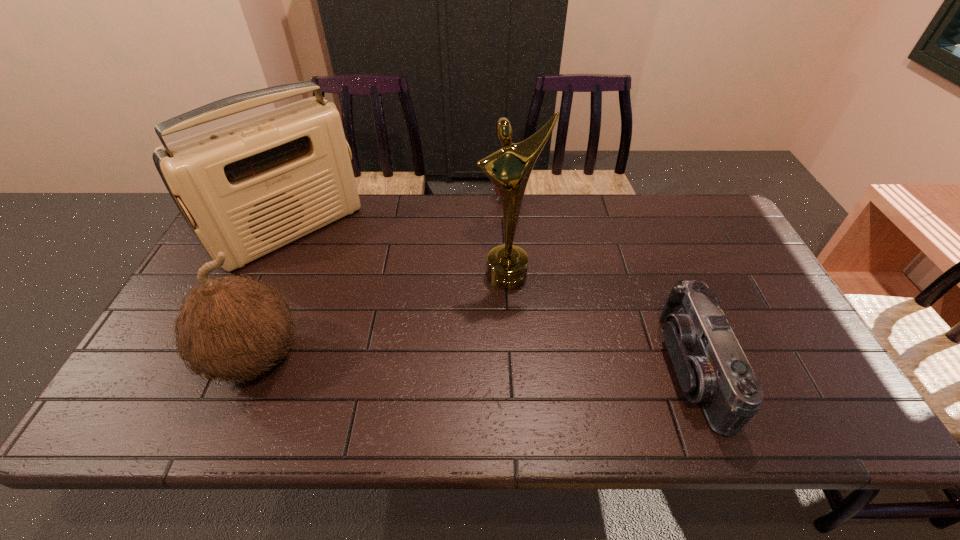
This screenshot has height=540, width=960. In order to click on camcorder that is at the near edge in this screenshot , I will do `click(712, 369)`.

Find the location of a particular element. The height and width of the screenshot is (540, 960). coconut that is at the left edge is located at coordinates (232, 327).

Locate an element on the screen. The width and height of the screenshot is (960, 540). radio receiver present at the left edge is located at coordinates (248, 188).

This screenshot has width=960, height=540. Find the location of `object that is at the far left corner`. object that is at the far left corner is located at coordinates (248, 188).

The height and width of the screenshot is (540, 960). In order to click on object positioned at the near left corner in this screenshot , I will do `click(232, 327)`.

At what (x,y) coordinates should I click in order to perform the action: click on vacant space at the far edge of the desktop. Please return your answer as a coordinate pair (x, y). This screenshot has height=540, width=960. Looking at the image, I should click on (632, 203).

At what (x,y) coordinates should I click in order to perform the action: click on vacant space at the left edge of the desktop. Please return your answer as a coordinate pair (x, y). This screenshot has width=960, height=540. Looking at the image, I should click on (173, 318).

Where is `unoccupied area between the radio receiver and the camcorder`? unoccupied area between the radio receiver and the camcorder is located at coordinates (492, 300).

Identify the location of free space between the third tallest object and the rightmost object. (473, 363).

The width and height of the screenshot is (960, 540). Identify the location of vacant point located between the award and the radio receiver. click(x=399, y=253).